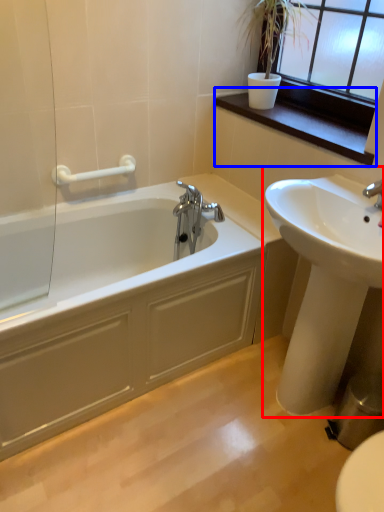
Question: Among these objects, which one is nearest to the camera, sink (highlighted by a red box) or window sill (highlighted by a blue box)?

Choices:
 (A) sink
 (B) window sill

Answer: (A)